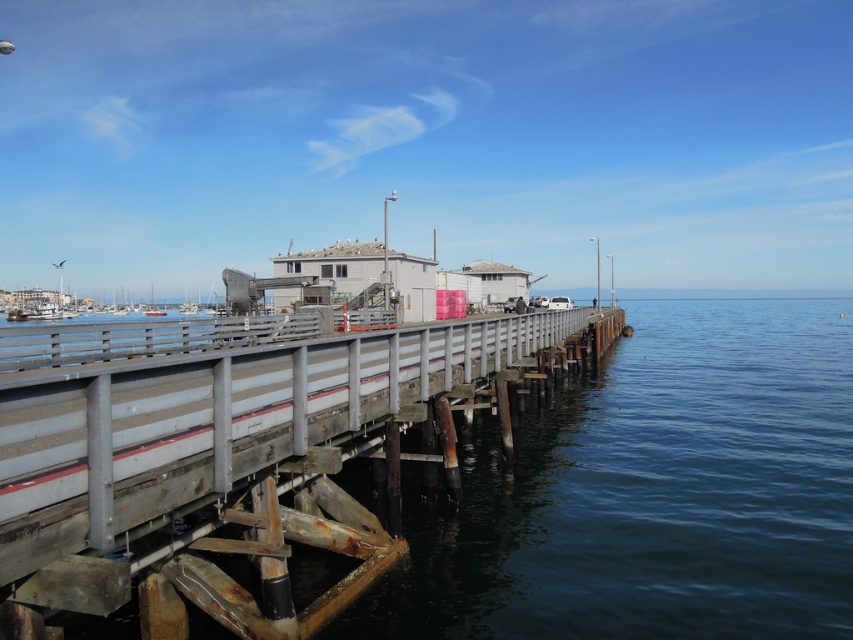
You are standing on the wooden pier and want to know which object you can see more of in the scene. Which is larger in size between the dark blue water at center and the rusty metal rail at center?

The dark blue water at center is bigger than the rusty metal rail at center, so you can see more of the dark blue water at center.

You are standing on the wooden pier and want to avoid stepping into the dark blue water at center. Which direction should you move relative to the rusty metal rail at center?

You should move away from the rusty metal rail at center because the dark blue water at center is located below it, so staying away from the rail would keep you on the pier and out of the water.